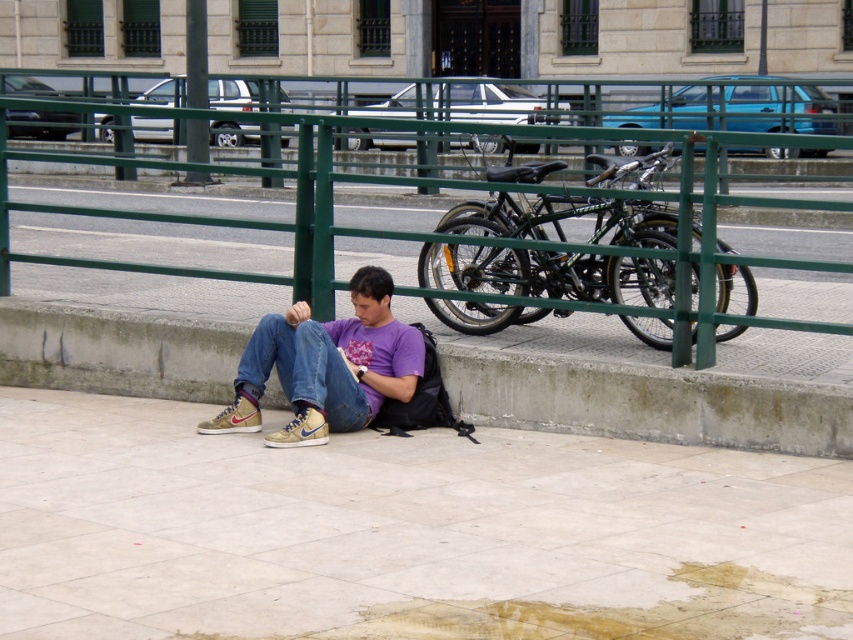
Who is lower down, shiny black bicycle at center or green metal fence at center?

Positioned lower is shiny black bicycle at center.

Is point (635, 241) farther from viewer compared to point (10, 256)?

No, (635, 241) is in front of (10, 256).

At what (x,y) coordinates should I click in order to perform the action: click on shiny black bicycle at center. Please return your answer as a coordinate pair (x, y). This screenshot has height=640, width=853. Looking at the image, I should click on (547, 273).

Is point (476, 400) closer to camera compared to point (329, 394)?

No, (476, 400) is behind (329, 394).

Which is behind, point (206, 333) or point (337, 323)?

The point (206, 333) is more distant.

Where is `concrete at lower left`? This screenshot has height=640, width=853. concrete at lower left is located at coordinates (647, 401).

Between smooth concrete pavement at lower center and concrete at lower left, which one has more height?

concrete at lower left is taller.

Does point (22, 468) come farther from viewer compared to point (73, 376)?

No, (22, 468) is closer to viewer.

You are a GUI agent. You are given a task and a screenshot of the screen. Output one action in this format:
    pyautogui.click(x=<x>, y=<y>)
    Task: Click on the smooth concrete pavement at lower center
    The height and width of the screenshot is (640, 853).
    Given the screenshot: What is the action you would take?
    pyautogui.click(x=404, y=532)